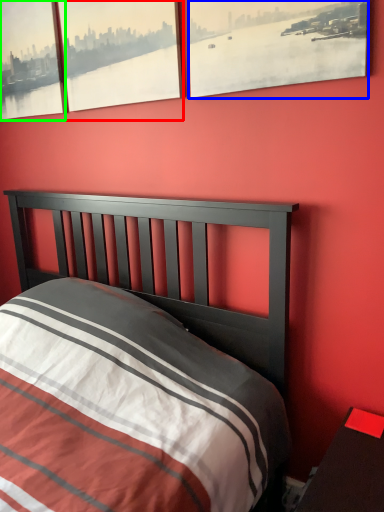
Question: Considering the real-world distances, which object is farthest from window (highlighted by a red box)? window (highlighted by a blue box) or window (highlighted by a green box)?

Choices:
 (A) window
 (B) window

Answer: (A)